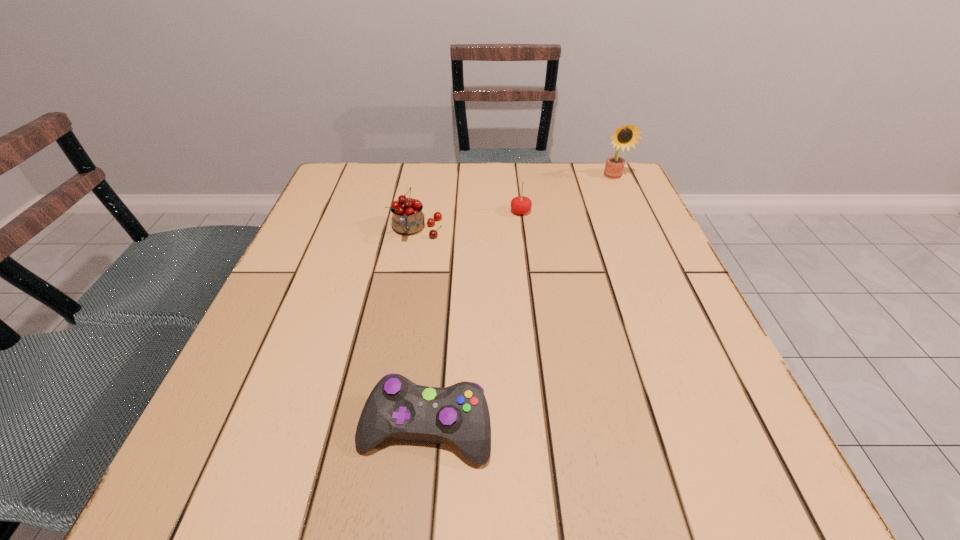
Locate an element on the screen. vacant space situated on the back of the shorter cherry is located at coordinates (516, 173).

Identify the location of vacant space situated 0.140m on the back of the shortest object. The image size is (960, 540). (436, 328).

You are a GUI agent. You are given a task and a screenshot of the screen. Output one action in this format:
    pyautogui.click(x=<x>, y=<y>)
    Task: Click on the sunflower present at the far edge
    
    Given the screenshot: What is the action you would take?
    pyautogui.click(x=626, y=136)

Identify the location of cherry that is at the far edge. (521, 205).

This screenshot has width=960, height=540. What are the coordinates of `object situated at the near edge` in the screenshot? It's located at (396, 407).

The height and width of the screenshot is (540, 960). Find the location of `object that is at the right edge`. object that is at the right edge is located at coordinates (626, 136).

Locate an element on the screen. object that is at the far right corner is located at coordinates (626, 136).

The width and height of the screenshot is (960, 540). I want to click on free region at the far edge, so click(481, 178).

In the image, there is a desktop. Where is `free space at the near edge`? The image size is (960, 540). free space at the near edge is located at coordinates (411, 471).

Find the location of `free space at the left edge`. free space at the left edge is located at coordinates pyautogui.click(x=362, y=220).